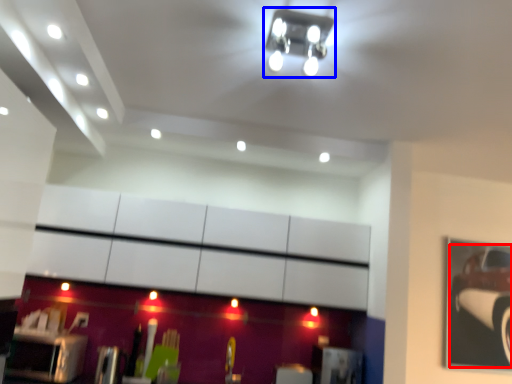
Question: Which point is further to the camera, car (highlighted by a red box) or light fixture (highlighted by a blue box)?

Choices:
 (A) car
 (B) light fixture

Answer: (A)